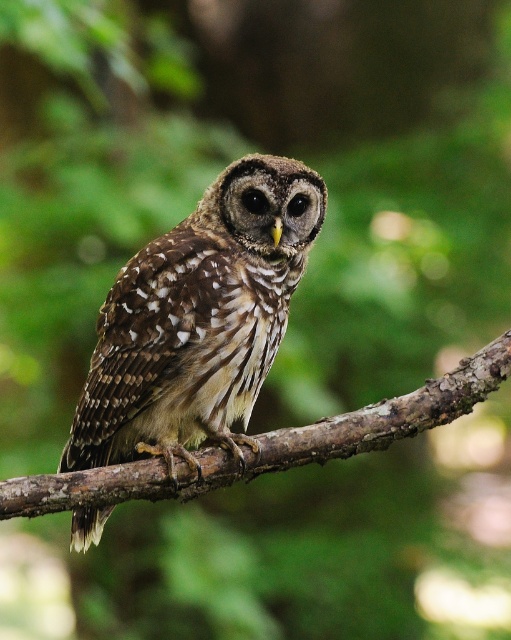
Question: Is brown speckled owl at center in front of brown rough branch at center?

Choices:
 (A) yes
 (B) no

Answer: (B)

Question: Which point is closer to the camera?

Choices:
 (A) brown rough branch at center
 (B) brown speckled owl at center

Answer: (A)

Question: Which point is farther to the camera?

Choices:
 (A) brown rough branch at center
 (B) brown speckled owl at center

Answer: (B)

Question: Which point is closer to the camera?

Choices:
 (A) (213, 394)
 (B) (151, 477)

Answer: (B)

Question: Can you confirm if brown speckled owl at center is wider than brown rough branch at center?

Choices:
 (A) no
 (B) yes

Answer: (A)

Question: Does brown speckled owl at center have a greater width compared to brown rough branch at center?

Choices:
 (A) yes
 (B) no

Answer: (B)